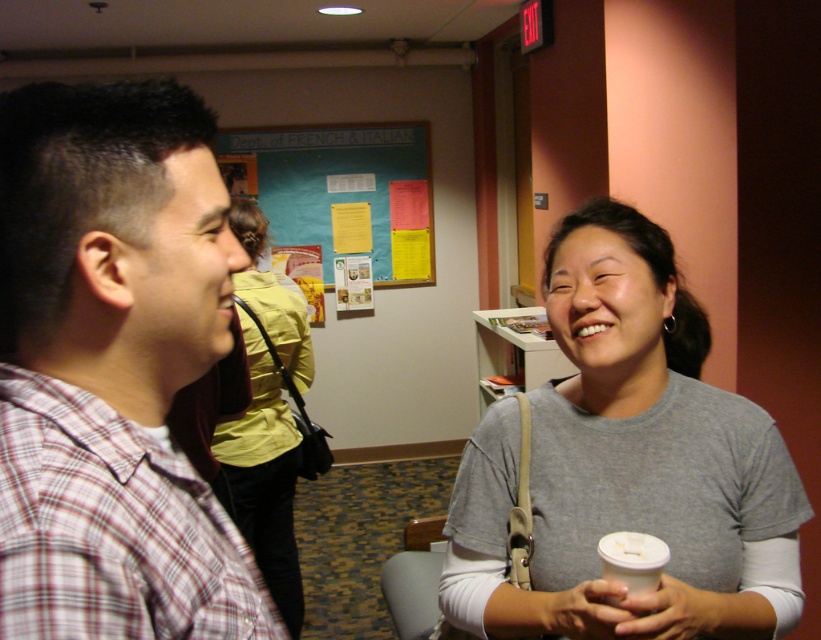
Question: Based on their relative distances, which object is farther from the teal paperboard at upper center?

Choices:
 (A) gray cotton shirt at center
 (B) plaid shirt at left
 (C) matte yellow shirt at center

Answer: (B)

Question: Does plaid shirt at left come in front of matte yellow shirt at center?

Choices:
 (A) yes
 (B) no

Answer: (A)

Question: Does plaid shirt at left have a smaller size compared to teal paperboard at upper center?

Choices:
 (A) yes
 (B) no

Answer: (A)

Question: Estimate the real-world distances between objects in this image. Which object is closer to the plaid shirt at left?

Choices:
 (A) matte yellow shirt at center
 (B) gray cotton shirt at center

Answer: (B)

Question: Which point appears farthest from the camera in this image?

Choices:
 (A) (688, 419)
 (B) (67, 333)
 (C) (384, 156)
 (D) (297, 580)

Answer: (C)

Question: Is plaid shirt at left bigger than gray cotton shirt at center?

Choices:
 (A) no
 (B) yes

Answer: (A)